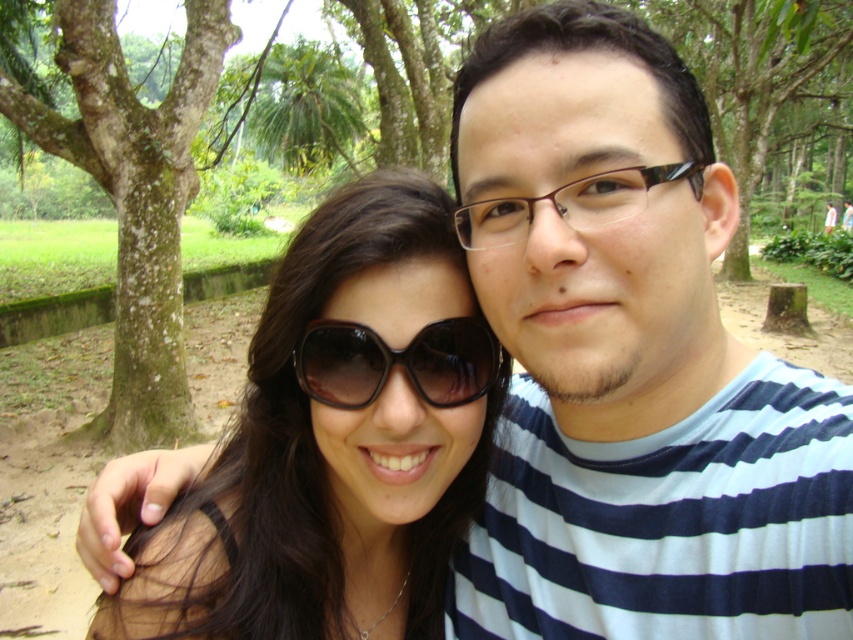
Can you confirm if green mossy tree at center is smaller than black plastic glasses at center?

No, green mossy tree at center is not smaller than black plastic glasses at center.

Between green mossy tree at center and black plastic glasses at center, which one has more height?

green mossy tree at center

Find the location of `green mossy tree at center`. green mossy tree at center is located at coordinates (769, 97).

Find the location of a particular element. green mossy tree at center is located at coordinates point(769,97).

Can you confirm if blue striped shirt at center is bigger than black glossy sunglasses at center?

Indeed, blue striped shirt at center has a larger size compared to black glossy sunglasses at center.

Is blue striped shirt at center above black glossy sunglasses at center?

Actually, blue striped shirt at center is below black glossy sunglasses at center.

Between point (659, 353) and point (338, 385), which one is positioned behind?

The point (338, 385) is more distant.

This screenshot has height=640, width=853. In order to click on blue striped shirt at center in this screenshot , I will do `click(630, 362)`.

How distant is blue striped shirt at center from green mossy bark tree at left?

A distance of 15.90 feet exists between blue striped shirt at center and green mossy bark tree at left.

Who is taller, blue striped shirt at center or green mossy bark tree at left?

green mossy bark tree at left

From the picture: Who is more distant from viewer, (479, 529) or (190, 74)?

The point (190, 74) is behind.

The width and height of the screenshot is (853, 640). Identify the location of blue striped shirt at center. (630, 362).